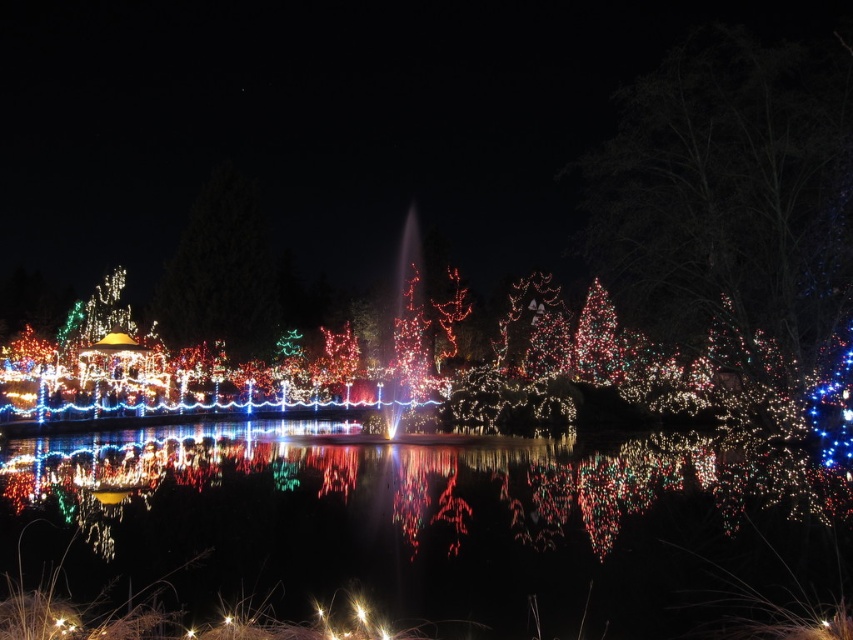
You are standing at the camera position and want to take a photo of the illuminated plastic tree at upper right. The camera has a maximum zoom range of 10 meters. Can you capture the entire tree in the photo without moving closer?

The illuminated plastic tree at upper right is 18.35 meters away from the camera. Since the camera can only zoom up to 10 meters, it cannot capture the entire tree without moving closer.

You are planning to place a new decoration between the illuminated plastic tree at upper right and the illuminated plastic tree at upper center. Based on their widths, which tree has more space around it to accommodate the decoration?

The illuminated plastic tree at upper right has more space around it because its width surpasses that of the illuminated plastic tree at upper center, meaning there is more room between them for placing the decoration.